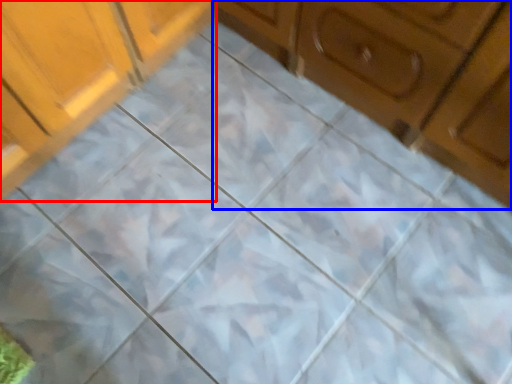
Question: Which point is further to the camera, cabinetry (highlighted by a red box) or cabinetry (highlighted by a blue box)?

Choices:
 (A) cabinetry
 (B) cabinetry

Answer: (A)